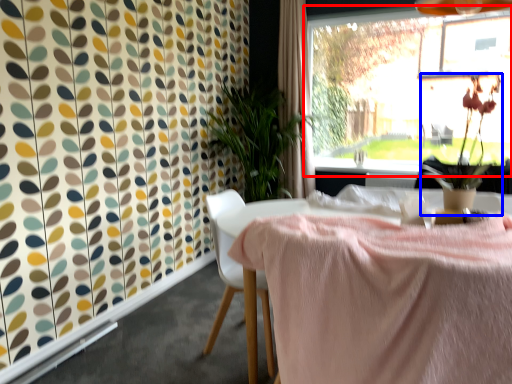
Question: Which object appears farthest to the camera in this image, window (highlighted by a red box) or floral arrangement (highlighted by a blue box)?

Choices:
 (A) window
 (B) floral arrangement

Answer: (A)